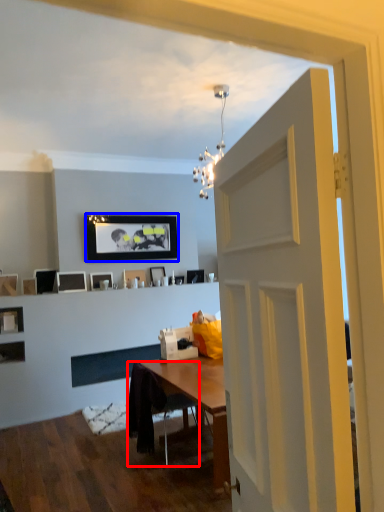
Question: Among these objects, which one is nearest to the camera, chair (highlighted by a red box) or picture frame (highlighted by a blue box)?

Choices:
 (A) chair
 (B) picture frame

Answer: (A)